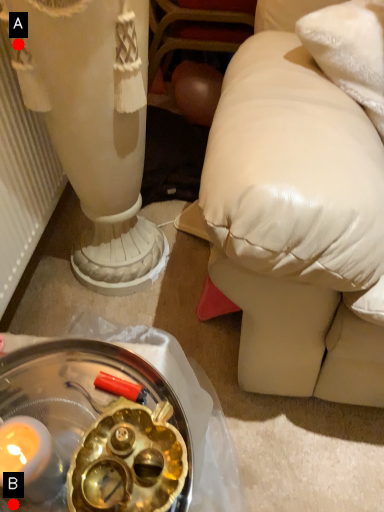
Question: Two points are circled on the image, labeled by A and B beside each circle. Which of the following is the closest to the observer?

Choices:
 (A) A is closer
 (B) B is closer

Answer: (B)